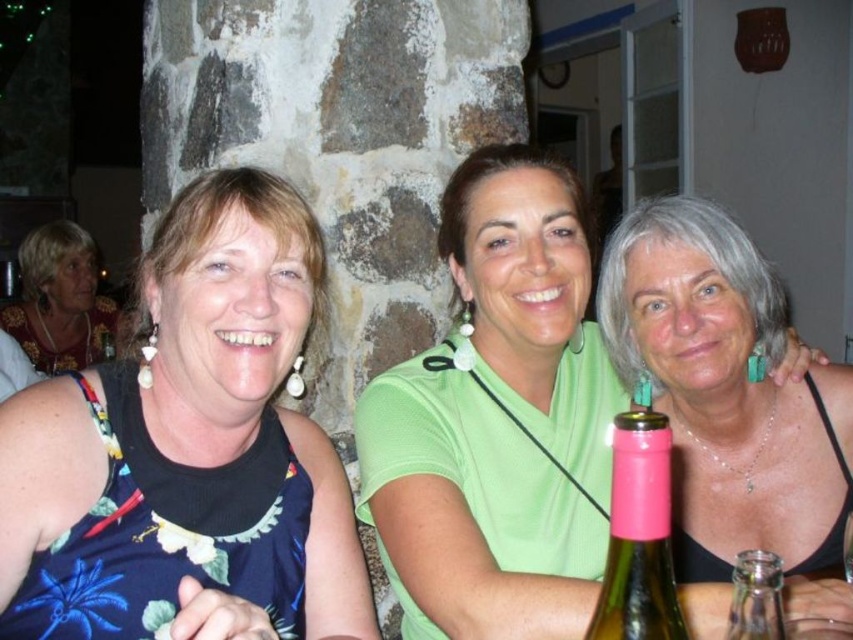
Does point (523, 554) come closer to viewer compared to point (846, 568)?

No.

Does green matte shirt at center appear on the right side of transparent glass at lower right?

Incorrect, green matte shirt at center is not on the right side of transparent glass at lower right.

Is point (485, 368) farther from camera compared to point (845, 561)?

Yes, it is behind point (845, 561).

Where is `green matte shirt at center`? Image resolution: width=853 pixels, height=640 pixels. green matte shirt at center is located at coordinates pyautogui.click(x=497, y=420).

Is blue floral dress at left smaller than transparent glass bottle at center?

No, blue floral dress at left is not smaller than transparent glass bottle at center.

Does blue floral dress at left appear on the right side of transparent glass bottle at center?

Incorrect, blue floral dress at left is not on the right side of transparent glass bottle at center.

The height and width of the screenshot is (640, 853). Identify the location of blue floral dress at left. (189, 451).

Is blue floral dress at left wider than matte black tank top at left?

No.

Is blue floral dress at left positioned in front of matte black tank top at left?

Yes.

Describe the element at coordinates (189, 451) in the screenshot. I see `blue floral dress at left` at that location.

The height and width of the screenshot is (640, 853). In order to click on blue floral dress at left in this screenshot , I will do `click(189, 451)`.